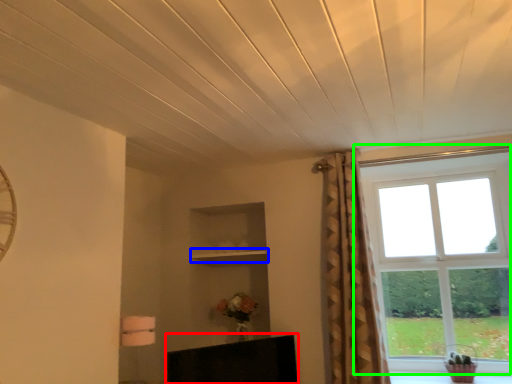
Question: Estimate the real-world distances between objects in this image. Which object is farther from furniture (highlighted by a red box), shelf (highlighted by a blue box) or window (highlighted by a green box)?

Choices:
 (A) shelf
 (B) window

Answer: (B)